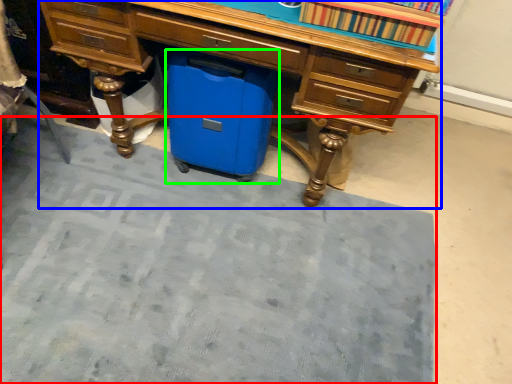
Question: Considering the real-world distances, which object is farthest from doormat (highlighted by a red box)? desk (highlighted by a blue box) or cooler (highlighted by a green box)?

Choices:
 (A) desk
 (B) cooler

Answer: (A)